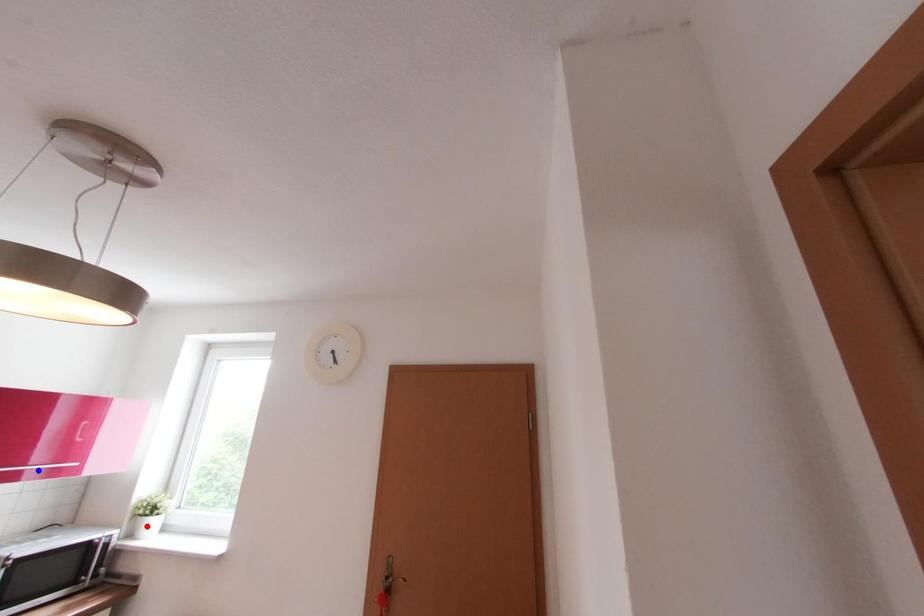
Question: In the image, two points are highlighted. Which point is nearer to the camera? Reply with the corresponding letter.

Choices:
 (A) blue point
 (B) red point

Answer: (A)